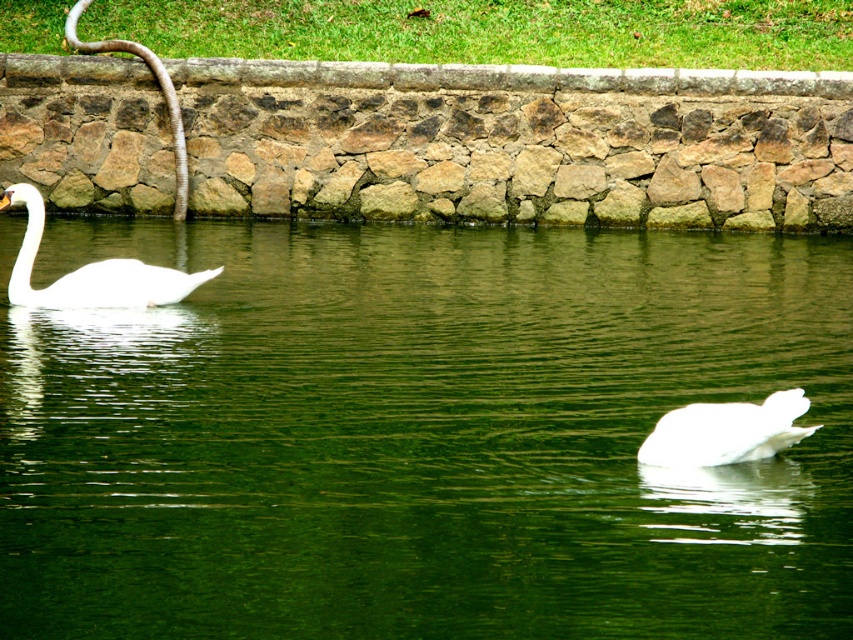
You are a photographer trying to capture the white matte swan at lower right. Since the green smooth water at center is in the way, can you see the swan clearly from your current position?

The green smooth water at center is taller than the white matte swan at lower right, so the water may block the view of the swan, making it difficult to see clearly.

You are standing on the grassy area behind the stone wall and see the white glossy swan at left and the green smooth water at center. Which object is closer to your current position?

The white glossy swan at left is closer to your current position because it is to the left of the green smooth water at center, and you are positioned behind the stone wall in the background.

You are observing two swans on the green smooth water at center. Which swan is closer to the water surface?

The swan on the right is partially submerged, so its head and part of its neck are closer to the water surface compared to the swan on the left which is fully visible above the water.